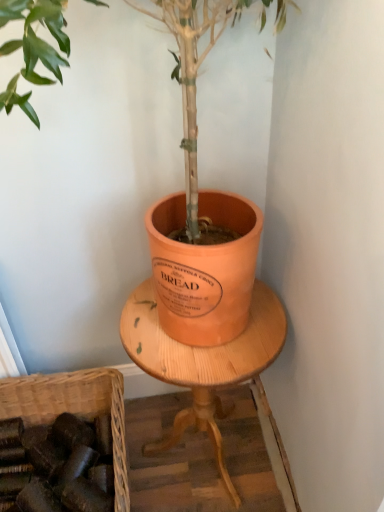
Question: From the image's perspective, is brown woven basket at lower left located above or below matte orange pot at center?

Choices:
 (A) above
 (B) below

Answer: (B)

Question: In the image, is brown woven basket at lower left on the left side or the right side of matte orange pot at center?

Choices:
 (A) right
 (B) left

Answer: (B)

Question: Which object is positioned farthest from the wooden round table at center?

Choices:
 (A) brown woven basket at lower left
 (B) matte orange pot at center

Answer: (A)

Question: Which of these objects is positioned closest to the matte orange pot at center?

Choices:
 (A) wooden round table at center
 (B) brown woven basket at lower left

Answer: (A)